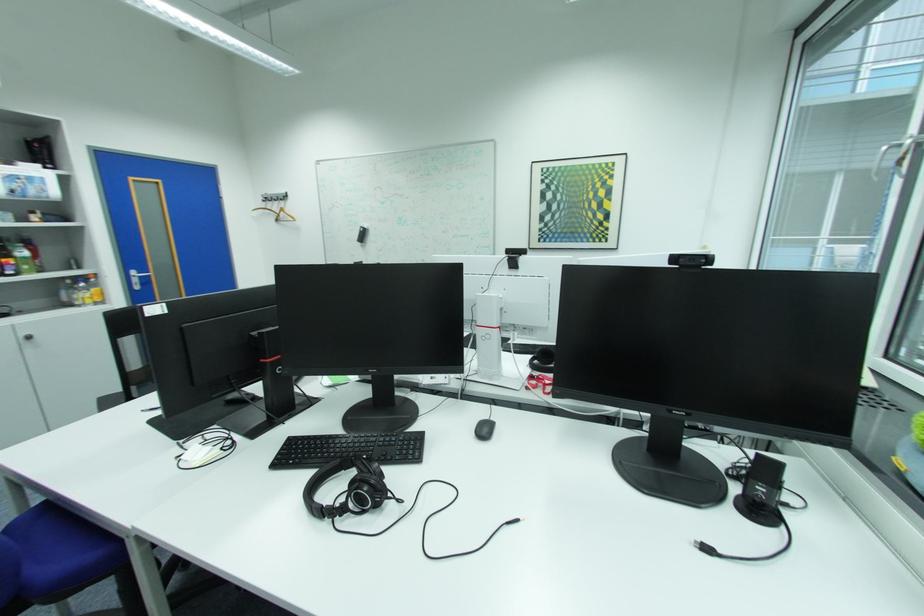
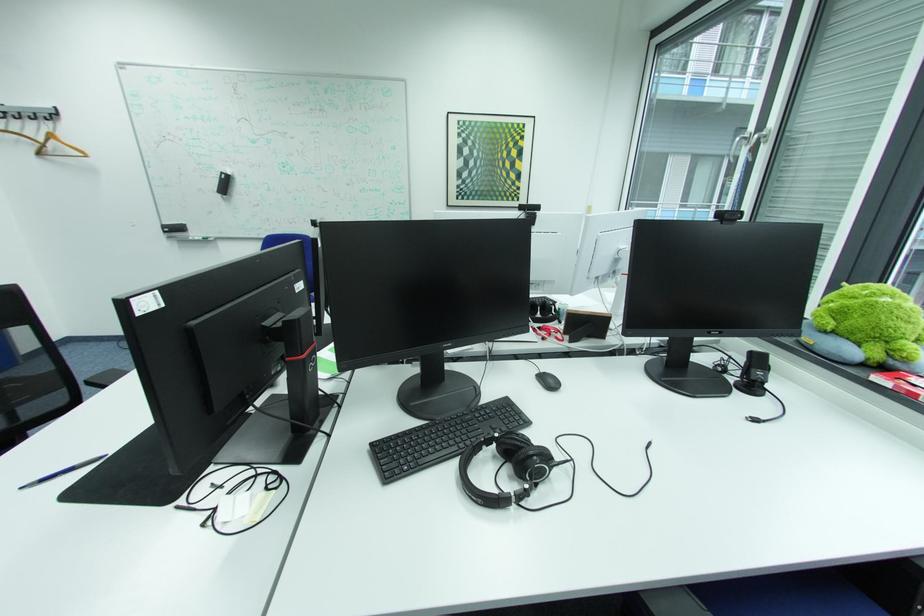
The point at (711, 261) is marked in the first image. Where is the corresponding point in the second image?

(748, 217)